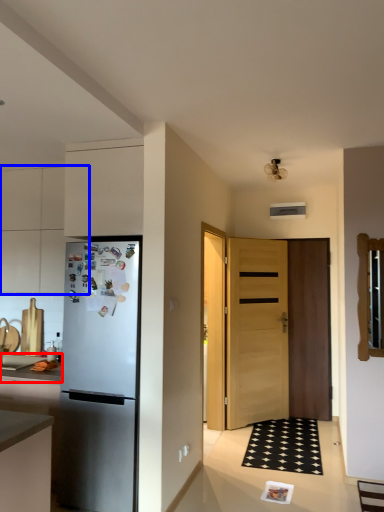
Question: Which of the following is the closest to the observer, countertop (highlighted by a red box) or cabinetry (highlighted by a blue box)?

Choices:
 (A) countertop
 (B) cabinetry

Answer: (A)